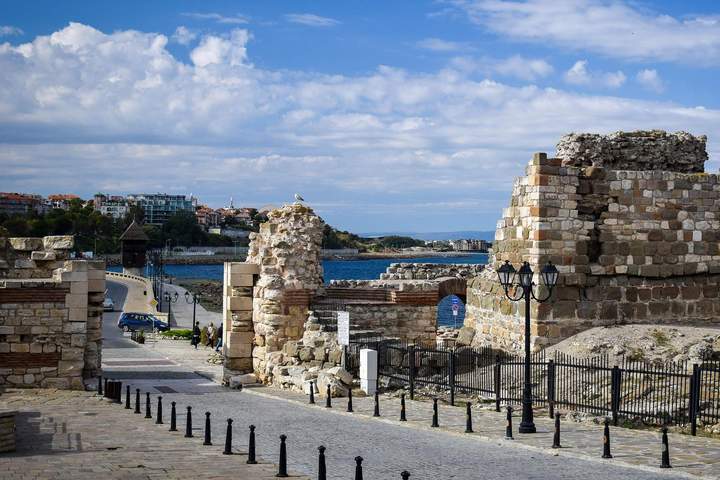
Identify the location of brick wall. point(42,337), point(408,317).